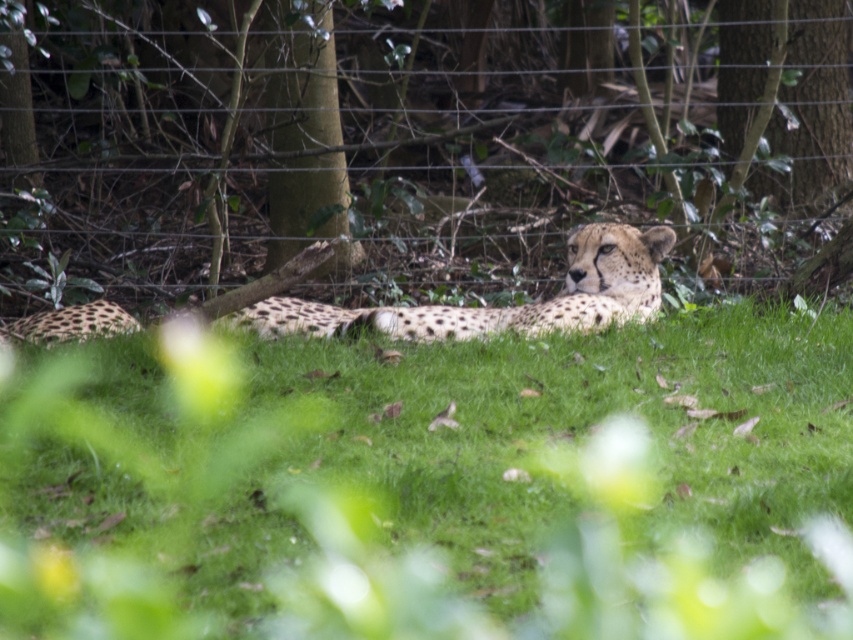
Between point (120, 467) and point (415, 326), which one is positioned in front?

Point (120, 467) is in front.

Can you confirm if green grassy at center is positioned to the right of spotted fur cheetah at center?

Yes, green grassy at center is to the right of spotted fur cheetah at center.

Who is more distant from viewer, [836,493] or [573,310]?

Point [573,310]

Locate an element on the screen. This screenshot has width=853, height=640. green grassy at center is located at coordinates (433, 486).

How distant is green grassy at center from wire mesh at center?

green grassy at center and wire mesh at center are 8.87 feet apart from each other.

Who is taller, green grassy at center or wire mesh at center?

Standing taller between the two is wire mesh at center.

Which is behind, point (744, 440) or point (24, 154)?

The point (24, 154) is behind.

Where is `green grassy at center`? The height and width of the screenshot is (640, 853). green grassy at center is located at coordinates (433, 486).

Is wire mesh at center thinner than spotted fur cheetah at center?

Incorrect, wire mesh at center's width is not less than spotted fur cheetah at center's.

Which is behind, point (566, 38) or point (325, 330)?

Positioned behind is point (566, 38).

The image size is (853, 640). I want to click on wire mesh at center, so click(413, 141).

Find the location of `wire mesh at center`. wire mesh at center is located at coordinates (413, 141).